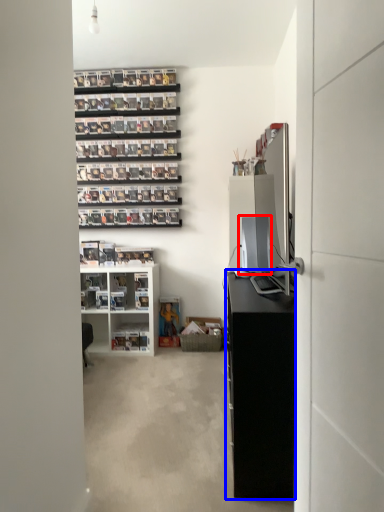
Question: Which object is closer to the camera taking this photo, desktop computer (highlighted by a red box) or cabinetry (highlighted by a blue box)?

Choices:
 (A) desktop computer
 (B) cabinetry

Answer: (B)